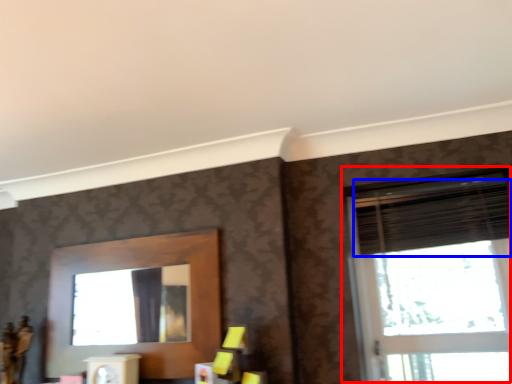
Question: Which object is closer to the camera taking this photo, window (highlighted by a red box) or blind (highlighted by a blue box)?

Choices:
 (A) window
 (B) blind

Answer: (A)